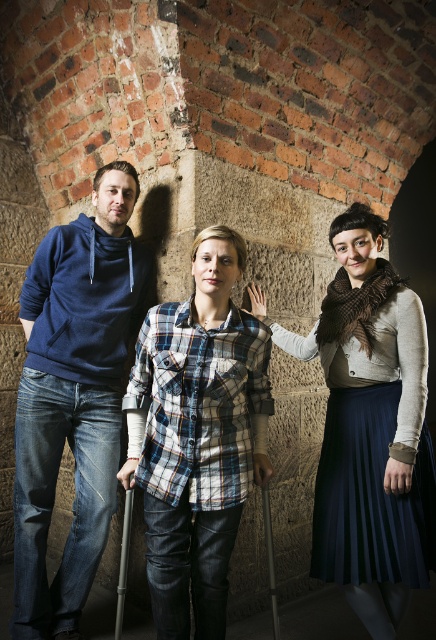
Is plaid shirt at center to the right of matte blue hoodie at left from the viewer's perspective?

Yes, plaid shirt at center is to the right of matte blue hoodie at left.

Who is taller, plaid shirt at center or matte blue hoodie at left?

With more height is plaid shirt at center.

Is point (303, 497) in front of point (78, 579)?

No, (303, 497) is behind (78, 579).

Image resolution: width=436 pixels, height=640 pixels. I want to click on plaid shirt at center, so click(55, 477).

Which is more to the left, matte blue hoodie at left or black plastic crutch at center?

Positioned to the left is matte blue hoodie at left.

Is matte blue hoodie at left smaller than black plastic crutch at center?

Actually, matte blue hoodie at left might be larger than black plastic crutch at center.

Between point (91, 323) and point (132, 493), which one is positioned in front?

Point (132, 493)

Locate an element on the screen. This screenshot has width=436, height=640. matte blue hoodie at left is located at coordinates (74, 397).

I want to click on matte blue hoodie at left, so click(x=74, y=397).

Who is more distant from viewer, (109, 276) or (381, 342)?

Positioned behind is point (109, 276).

What do you see at coordinates (74, 397) in the screenshot?
I see `matte blue hoodie at left` at bounding box center [74, 397].

At what (x,y) coordinates should I click in order to perform the action: click on matte blue hoodie at left. Please return your answer as a coordinate pair (x, y). This screenshot has width=436, height=640. Looking at the image, I should click on (74, 397).